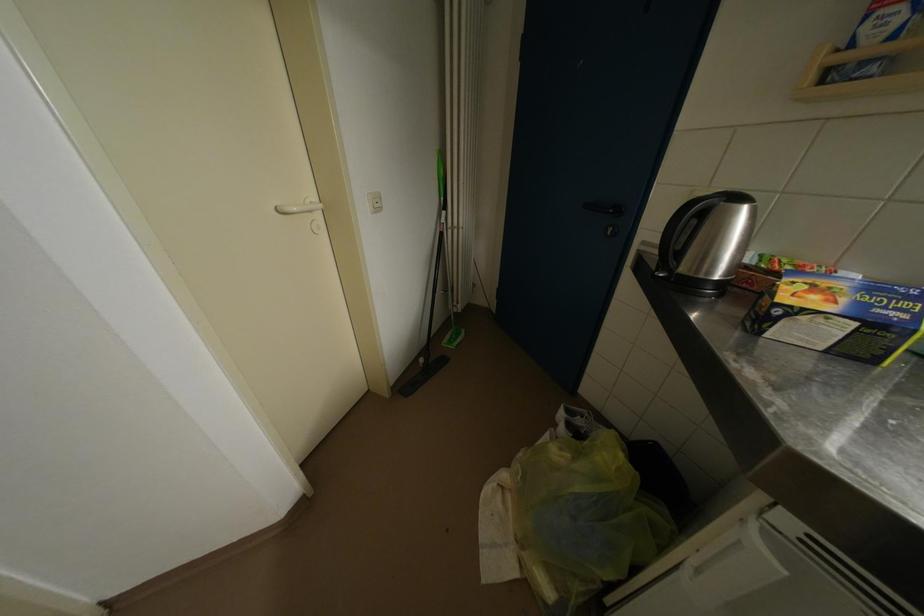
Where would you pull the white door handle? Please return your answer as a coordinate pair (x, y).

(298, 208)